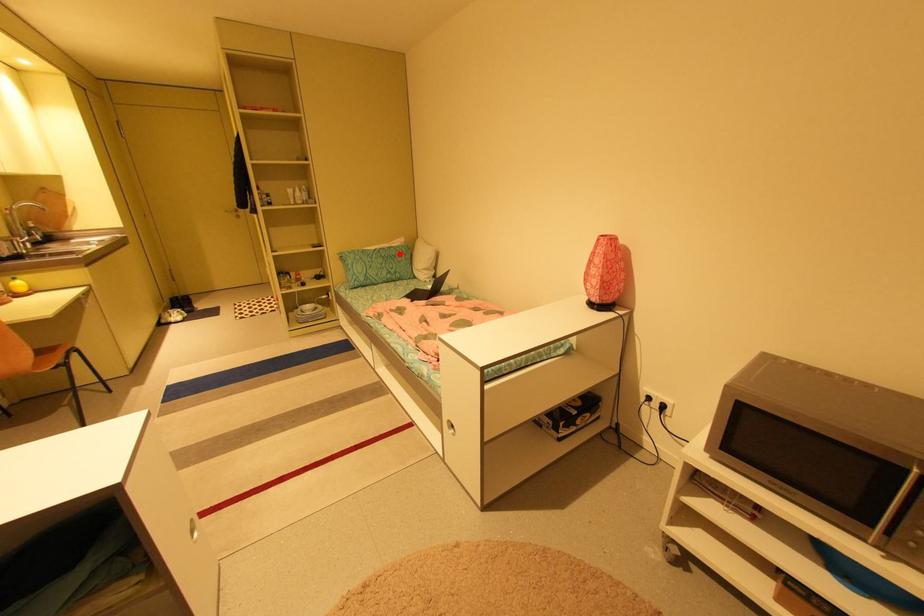
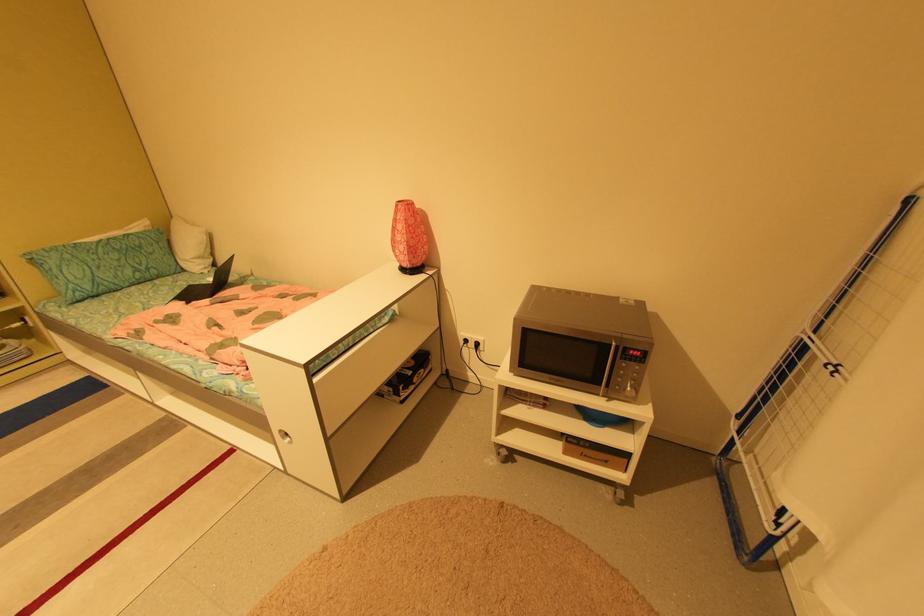
Question: A red point is marked in image1. In image2, is the corresponding 3D point closer to the camera or farther? Reply with the corresponding letter.

Choices:
 (A) The corresponding 3D point is closer.
 (B) The corresponding 3D point is farther.

Answer: (B)